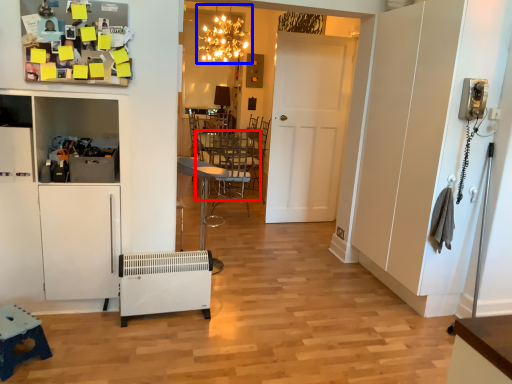
Question: Which point is closer to the camera, table (highlighted by a red box) or light fixture (highlighted by a blue box)?

Choices:
 (A) table
 (B) light fixture

Answer: (A)